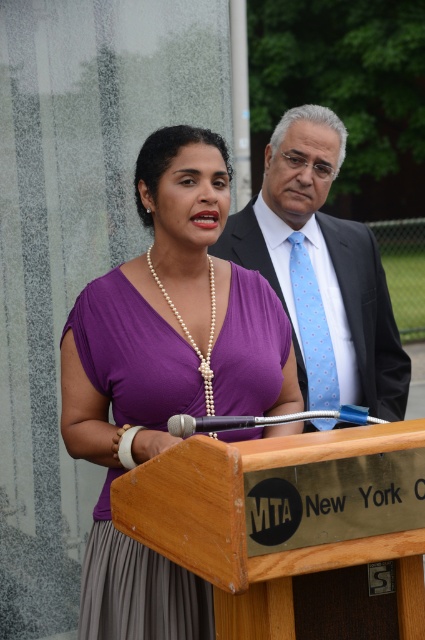
You are a photographer at the event and want to capture a closeup of the blue dotted tie at center and pearl necklace at center. Which one should you focus on first to ensure it appears sharp in the photo?

The blue dotted tie at center should be focused on first because it is closer to the viewer than the pearl necklace at center, ensuring it will appear sharp.

You are a photographer at the event and need to ensure that both the purple satin dress at center and the pearl necklace at center are visible in your photo. Based on their sizes, which object should you focus on to capture both without cropping?

The purple satin dress at center is wider than the pearl necklace at center, so focusing on the dress will ensure both are visible as the necklace is narrower and can fit within the frame when the dress is centered.